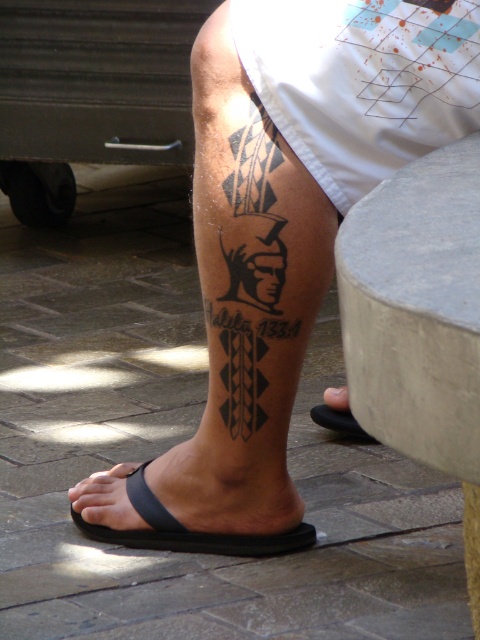
Which of these two, black ink tattoo at lower center or white cotton shorts at upper right, stands shorter?

With less height is white cotton shorts at upper right.

Which is in front, point (205, 99) or point (370, 12)?

Point (370, 12)

Locate an element on the screen. The width and height of the screenshot is (480, 640). black ink tattoo at lower center is located at coordinates (233, 353).

At what (x,y) coordinates should I click in order to perform the action: click on black ink tattoo at lower center. Please return your answer as a coordinate pair (x, y). The width and height of the screenshot is (480, 640). Looking at the image, I should click on (233, 353).

Can you confirm if white cotton shorts at upper right is bigger than black matte sandal at lower left?

Yes, white cotton shorts at upper right is bigger than black matte sandal at lower left.

Where is `white cotton shorts at upper right`? white cotton shorts at upper right is located at coordinates (361, 81).

Who is higher up, black ink tattoo at lower center or black matte sandal at lower left?

black ink tattoo at lower center is higher up.

Who is positioned more to the left, black ink tattoo at lower center or black matte sandal at lower left?

From the viewer's perspective, black matte sandal at lower left appears more on the left side.

Is point (275, 365) closer to camera compared to point (126, 545)?

Yes, it is.

At what (x,y) coordinates should I click in order to perform the action: click on black ink tattoo at lower center. Please return your answer as a coordinate pair (x, y). The image size is (480, 640). Looking at the image, I should click on (233, 353).